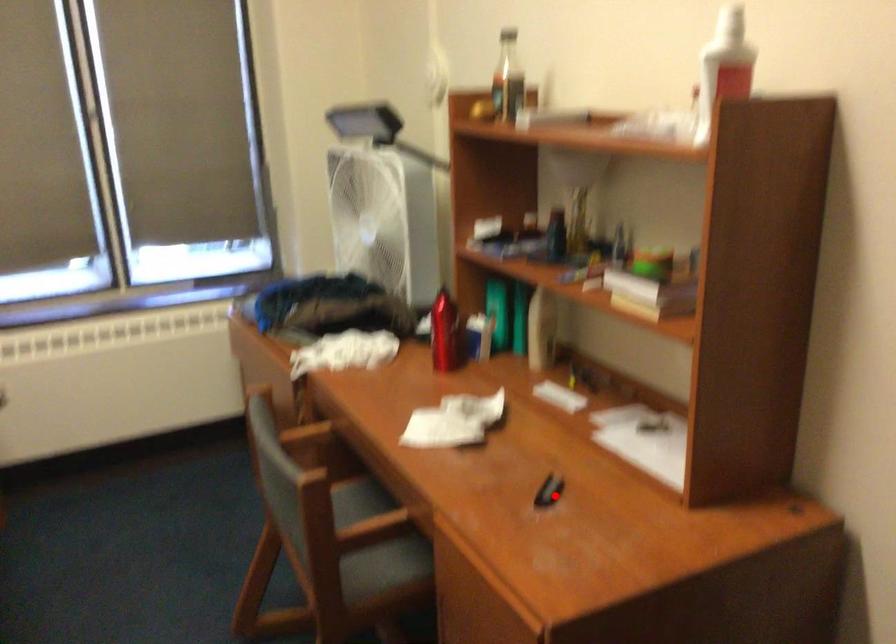
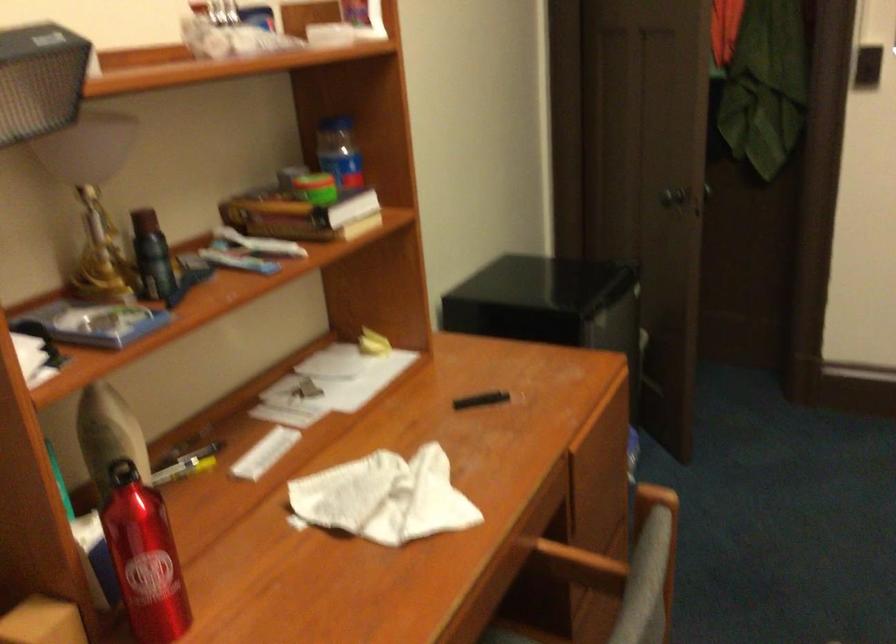
The point at the highlighted location is marked in the first image. Where is the corresponding point in the second image?

(480, 400)